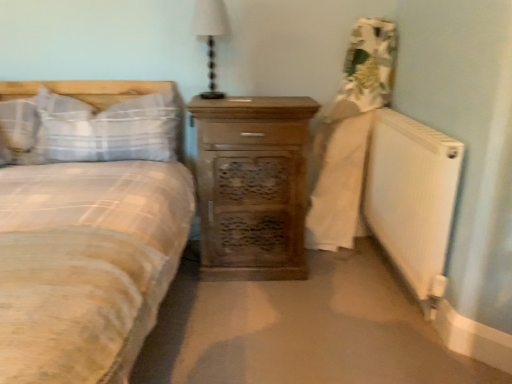
Find the location of a particular element. The width and height of the screenshot is (512, 384). free space on the front side of wooden chest of drawers at center is located at coordinates (255, 316).